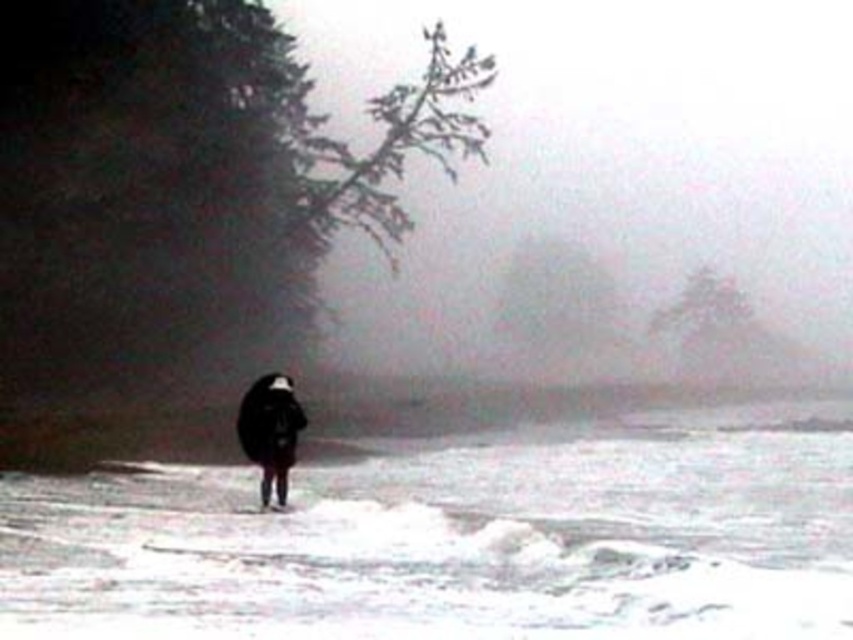
You are a photographer trying to capture the scene. You want to ensure the white frothy water at center and the black matte coat at center are both visible in your shot. Based on their positions, which object should you focus on first to ensure both are in frame?

The black matte coat at center is to the left of the white frothy water at center, so focusing on the black matte coat at center first will allow you to adjust the frame to include both objects since the white frothy water at center is positioned to its right.

You are a photographer trying to capture the scene. You notice the white frothy water at center and the black matte coat at center. Which object is lower in height compared to the other?

The white frothy water at center is shorter than the black matte coat at center, so the white frothy water at center is lower in height compared to the black matte coat at center.